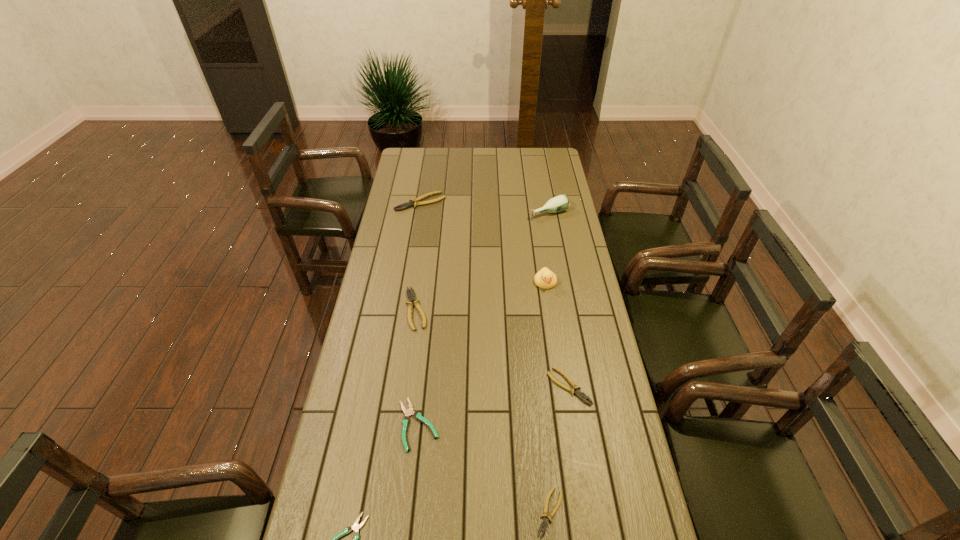
At what (x,y) coordinates should I click in order to perform the action: click on bottle. Please return your answer as a coordinate pair (x, y). The image size is (960, 540). Looking at the image, I should click on (559, 203).

Image resolution: width=960 pixels, height=540 pixels. I want to click on yellow duckling, so click(x=545, y=279).

The width and height of the screenshot is (960, 540). In order to click on the biggest yellow pliers in this screenshot , I will do `click(413, 202)`.

Where is `the tallest pliers`? This screenshot has width=960, height=540. the tallest pliers is located at coordinates (413, 202).

Identify the location of the second biggest yellow pliers. This screenshot has width=960, height=540. (411, 297).

At what (x,y) coordinates should I click in order to perform the action: click on the fifth shortest pliers. Please return your answer as a coordinate pair (x, y). The image size is (960, 540). Looking at the image, I should click on (411, 297).

Locate an element on the screen. Image resolution: width=960 pixels, height=540 pixels. the second smallest yellow pliers is located at coordinates (578, 392).

The image size is (960, 540). Identify the location of the second nearest yellow pliers. (578, 392).

You are a GUI agent. You are given a task and a screenshot of the screen. Output one action in this format:
    pyautogui.click(x=<x>, y=<y>)
    Task: Click on the farther teal pliers
    The height and width of the screenshot is (540, 960).
    Given the screenshot: What is the action you would take?
    pyautogui.click(x=408, y=412)

This screenshot has height=540, width=960. Identify the location of the bigger teal pliers. (408, 412).